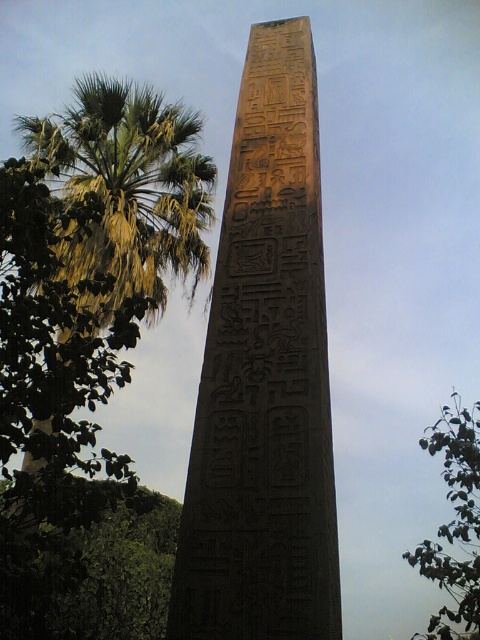
Question: Which object appears closest to the camera in this image?

Choices:
 (A) green leafy palm tree at left
 (B) green leafy tree at upper right
 (C) brown carved stone obelisk at center

Answer: (C)

Question: Which of the following is the farthest from the observer?

Choices:
 (A) brown carved stone obelisk at center
 (B) green leafy tree at upper right
 (C) green leafy palm tree at left

Answer: (C)

Question: Can you confirm if green leafy palm tree at left is positioned to the right of green leafy tree at upper right?

Choices:
 (A) yes
 (B) no

Answer: (B)

Question: Which of the following is the closest to the observer?

Choices:
 (A) (159, 289)
 (B) (271, 541)
 (C) (462, 480)

Answer: (B)

Question: Does brown carved stone obelisk at center have a larger size compared to green leafy tree at upper right?

Choices:
 (A) no
 (B) yes

Answer: (A)

Question: Is green leafy palm tree at left closer to camera compared to green leafy tree at upper right?

Choices:
 (A) no
 (B) yes

Answer: (A)